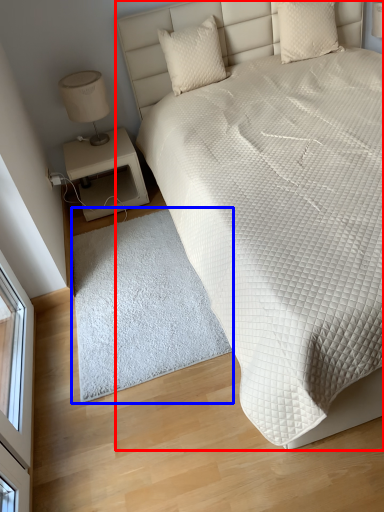
Question: Which of the following is the farthest to the observer, bed (highlighted by a red box) or mat (highlighted by a blue box)?

Choices:
 (A) bed
 (B) mat

Answer: (B)